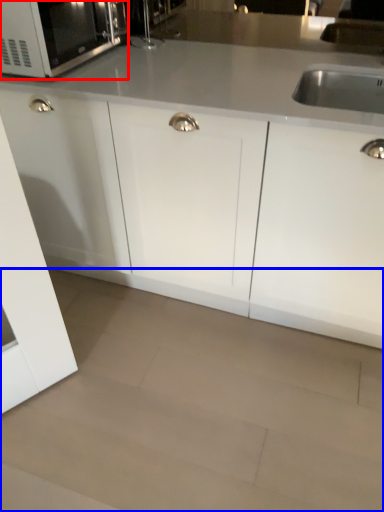
Question: Which object is closer to the camera taking this photo, microwave oven (highlighted by a red box) or granite (highlighted by a blue box)?

Choices:
 (A) microwave oven
 (B) granite

Answer: (B)